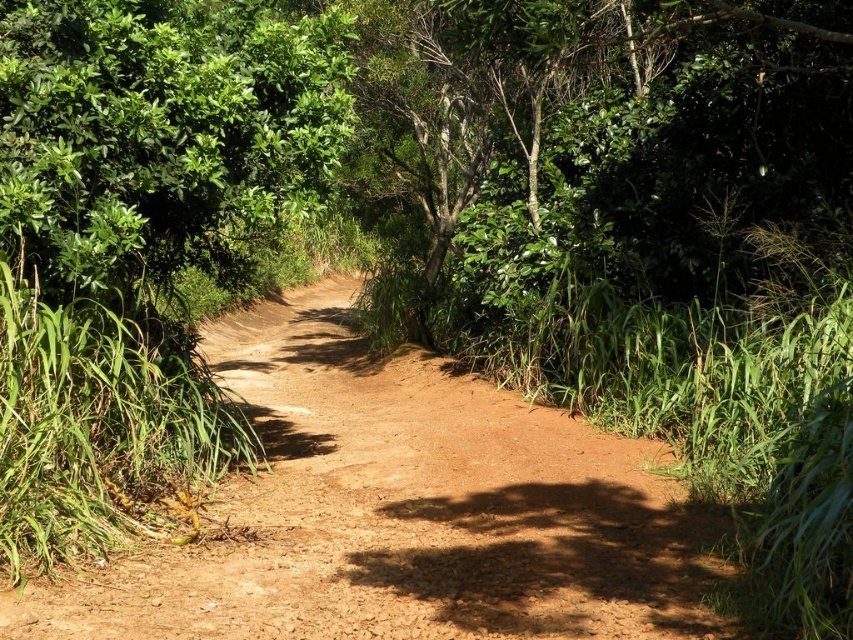
Question: Can you confirm if dusty brown dirt track at center is positioned above green leafy tree at upper left?

Choices:
 (A) yes
 (B) no

Answer: (B)

Question: Is dusty brown dirt track at center bigger than green leafy tree at upper left?

Choices:
 (A) no
 (B) yes

Answer: (B)

Question: Which of the following is the farthest from the observer?

Choices:
 (A) (653, 570)
 (B) (250, 44)

Answer: (B)

Question: Which point is closer to the camera taking this photo?

Choices:
 (A) (238, 589)
 (B) (315, 36)

Answer: (A)

Question: Which object is farther from the camera taking this photo?

Choices:
 (A) green leafy tree at upper left
 (B) dusty brown dirt track at center

Answer: (A)

Question: Can you confirm if dusty brown dirt track at center is positioned below green leafy tree at upper left?

Choices:
 (A) no
 (B) yes

Answer: (B)